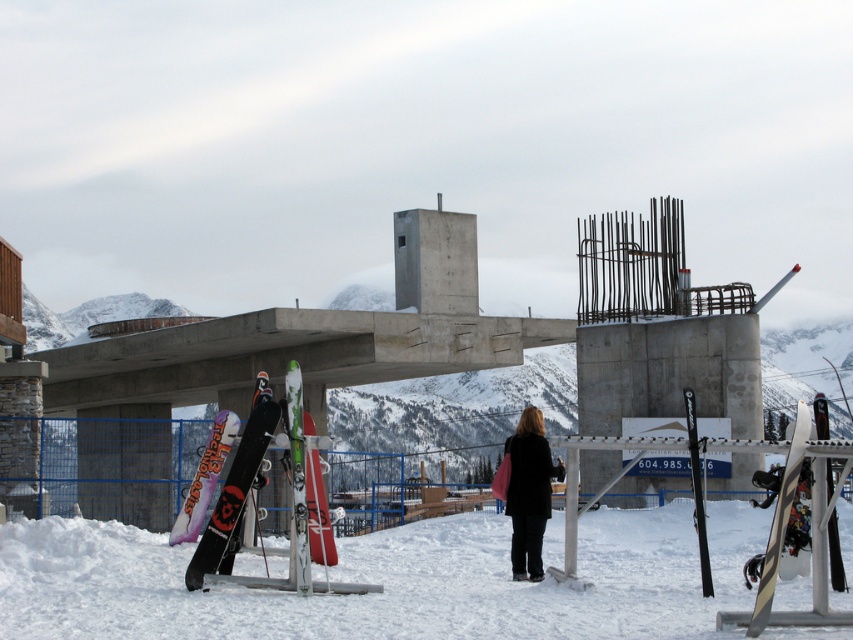
Question: Which point is closer to the camera?

Choices:
 (A) (517, 556)
 (B) (316, 554)
 (C) (198, 472)
 (D) (111, 529)

Answer: (B)

Question: Which object is closer to the camera taking this photo?

Choices:
 (A) white snowboard at lower center
 (B) matte red snowboard at center
 (C) striped wood snowboard at right

Answer: (A)

Question: Does striped wood snowboard at right have a smaller size compared to matte red snowboard at center?

Choices:
 (A) yes
 (B) no

Answer: (B)

Question: Does black matte coat at center have a larger size compared to green matte snowboard at center?

Choices:
 (A) yes
 (B) no

Answer: (A)

Question: Among these points, which one is farthest from the camera?

Choices:
 (A) (195, 486)
 (B) (524, 472)

Answer: (A)

Question: Considering the relative positions of white snowboard at lower center and striped wood snowboard at right in the image provided, where is white snowboard at lower center located with respect to striped wood snowboard at right?

Choices:
 (A) left
 (B) right

Answer: (A)